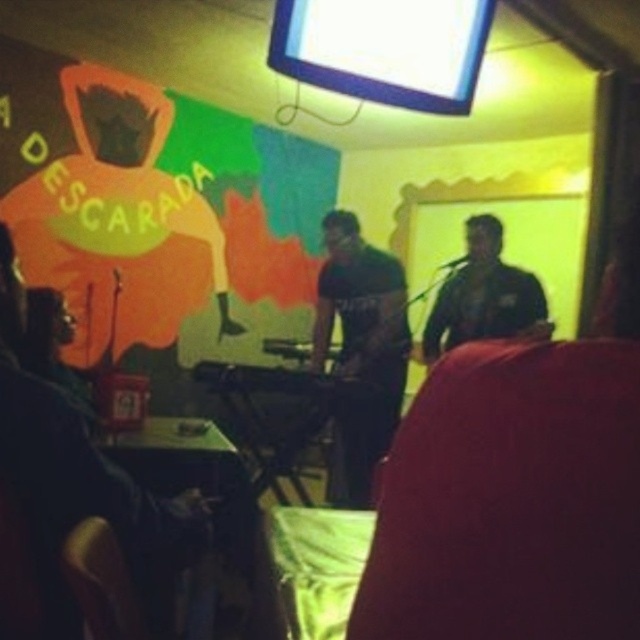
Question: Can you confirm if black matte keyboard at center is positioned to the right of black matte guitar at center?

Choices:
 (A) no
 (B) yes

Answer: (A)

Question: Which point is closer to the camera?

Choices:
 (A) black matte keyboard at center
 (B) black matte guitar at center

Answer: (B)

Question: Which point is closer to the camera taking this photo?

Choices:
 (A) (376, 445)
 (B) (444, 323)

Answer: (A)

Question: In this image, where is black matte keyboard at center located relative to black matte guitar at center?

Choices:
 (A) above
 (B) below

Answer: (B)

Question: Is black matte keyboard at center above black matte guitar at center?

Choices:
 (A) no
 (B) yes

Answer: (A)

Question: Which of the following is the farthest from the observer?

Choices:
 (A) (545, 314)
 (B) (326, 300)

Answer: (B)